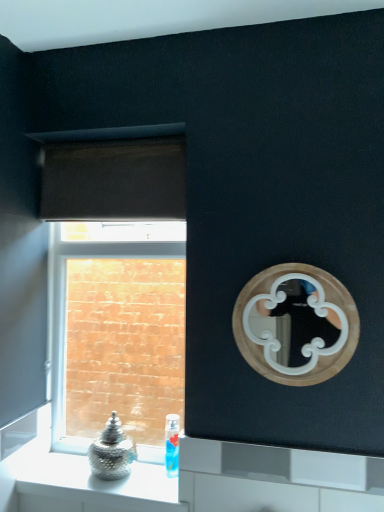
Find the location of `vacant region above metallic glass jar at lower left (from a real-world perspective)`. vacant region above metallic glass jar at lower left (from a real-world perspective) is located at coordinates [115, 476].